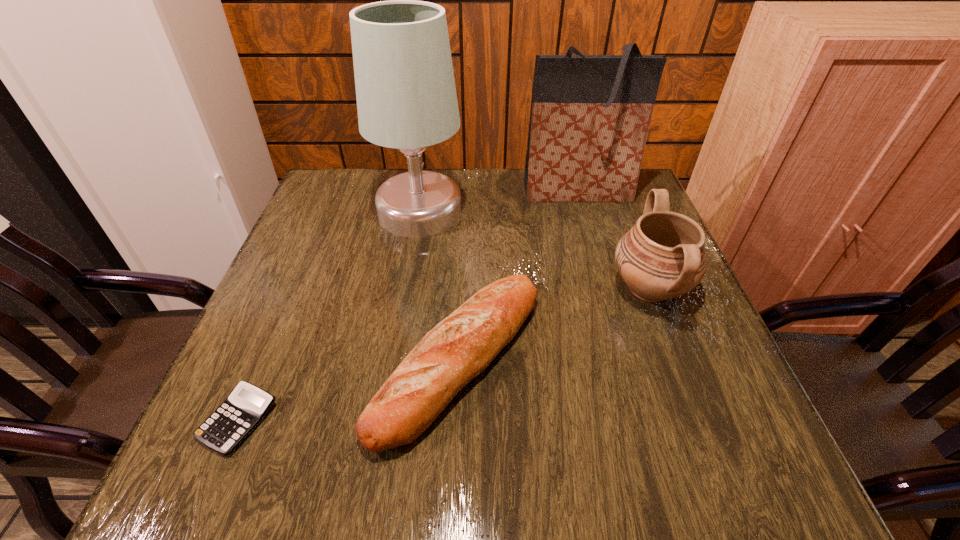
The height and width of the screenshot is (540, 960). I want to click on free space between the second shortest object and the urn, so click(x=554, y=323).

Image resolution: width=960 pixels, height=540 pixels. Identify the location of vacant area that lies between the leftmost object and the second shortest object. (348, 389).

Image resolution: width=960 pixels, height=540 pixels. In order to click on blank region between the third tallest object and the fourth tallest object in this screenshot , I will do `click(554, 323)`.

Locate an element on the screen. blank region between the third tallest object and the shopping bag is located at coordinates (613, 240).

Where is `unoccupied area between the second shortest object and the shortest object`? This screenshot has height=540, width=960. unoccupied area between the second shortest object and the shortest object is located at coordinates (348, 389).

I want to click on free spot between the third shortest object and the lampshade, so click(535, 250).

Locate which object is the third closest to the urn. Please provide its 2D coordinates. Your answer should be formatted as a tuple, i.e. [(x, y)], where the tuple contains the x and y coordinates of a point satisfying the conditions above.

[(406, 97)]

Identify which object is the third nearest to the second tallest object. Please provide its 2D coordinates. Your answer should be formatted as a tuple, i.e. [(x, y)], where the tuple contains the x and y coordinates of a point satisfying the conditions above.

[(460, 347)]

The image size is (960, 540). Find the location of `vacant space that satisfies the following two spatial constraints: 1. on the base of the tallest object; 2. on the right side of the second shortest object`. vacant space that satisfies the following two spatial constraints: 1. on the base of the tallest object; 2. on the right side of the second shortest object is located at coordinates 396,359.